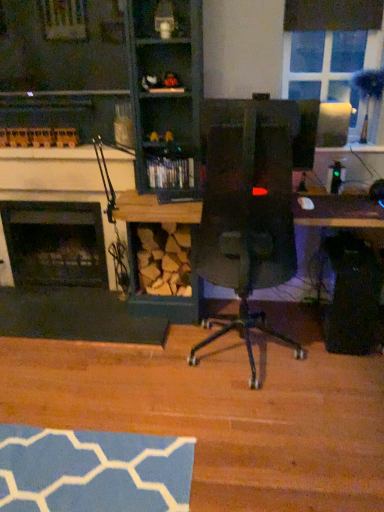
At what (x,y) coordinates should I click in order to perform the action: click on free space in front of black glass fireplace at left, which appears as the first fireplace when viewed from the front. Please return your answer as a coordinate pair (x, y). The height and width of the screenshot is (512, 384). Looking at the image, I should click on pos(60,350).